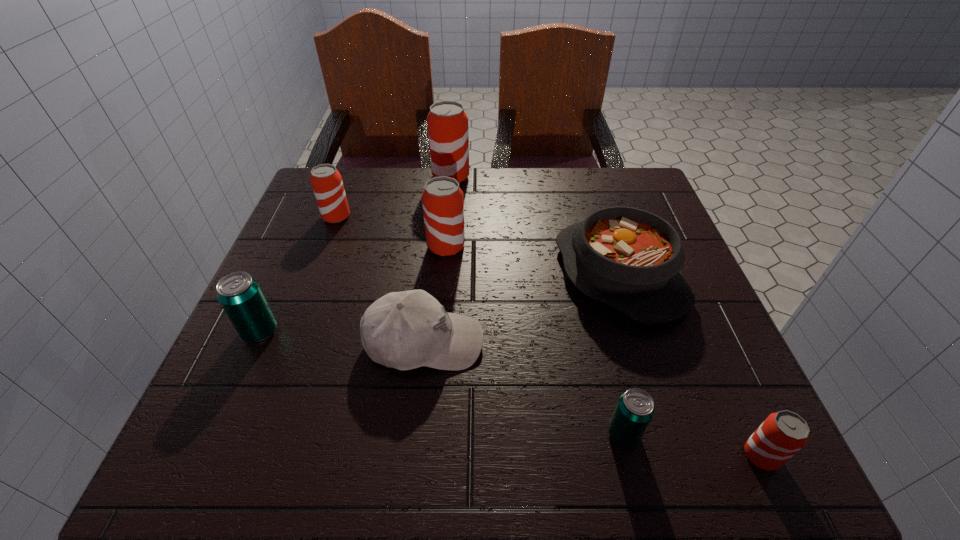
This screenshot has height=540, width=960. Identify the location of vacant space located on the back of the fifth beer can from left to right. (581, 257).

At what (x,y) coordinates should I click in order to perform the action: click on free space located 0.140m on the back of the rightmost beer can. Please return your answer as a coordinate pair (x, y). Looking at the image, I should click on (719, 364).

Where is `casserole positioned at the right edge`? casserole positioned at the right edge is located at coordinates (630, 259).

You are a GUI agent. You are given a task and a screenshot of the screen. Output one action in this format:
    pyautogui.click(x=<x>, y=<y>)
    Task: Click on the beer can that is positioned at the right edge
    This screenshot has height=540, width=960.
    Given the screenshot: What is the action you would take?
    pyautogui.click(x=782, y=434)

Find the location of a particular element. The height and width of the screenshot is (540, 960). object that is at the far left corner is located at coordinates (326, 181).

The height and width of the screenshot is (540, 960). I want to click on object that is at the near right corner, so click(782, 434).

Where is `free space at the far edge`? free space at the far edge is located at coordinates (498, 200).

Locate an element on the screen. free location at the near edge of the desktop is located at coordinates (549, 421).

Locate an element on the screen. This screenshot has height=540, width=960. vacant region at the left edge of the desktop is located at coordinates (307, 384).

The width and height of the screenshot is (960, 540). In the image, there is a desktop. Find the location of `vacant region at the near left corner`. vacant region at the near left corner is located at coordinates (264, 464).